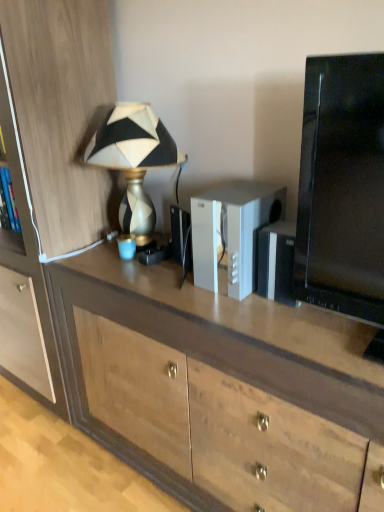
You are a GUI agent. You are given a task and a screenshot of the screen. Output one action in this format:
    pyautogui.click(x=<x>, y=<y>)
    Task: Click on the vacant space in front of metallic gold lamp at upper left
    
    Given the screenshot: What is the action you would take?
    pyautogui.click(x=137, y=279)